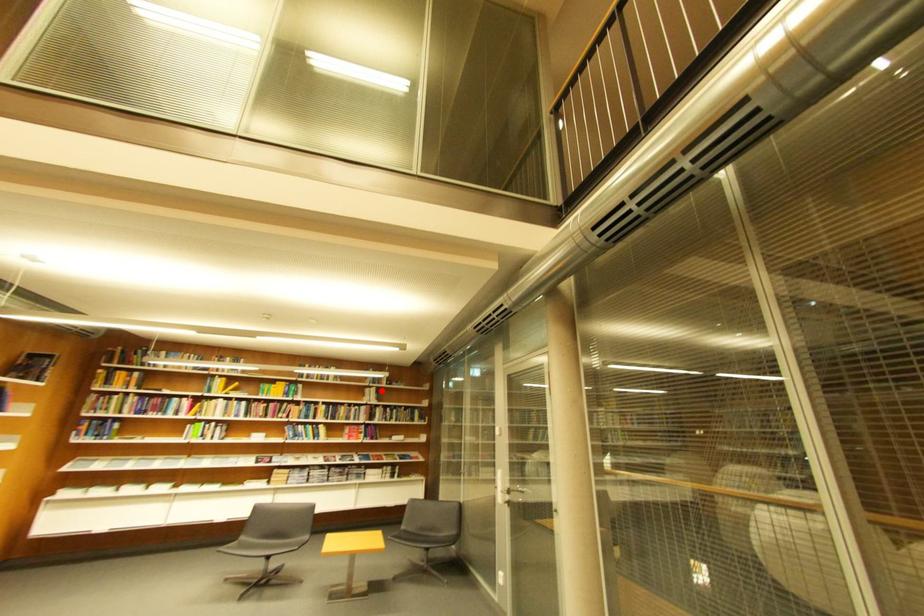
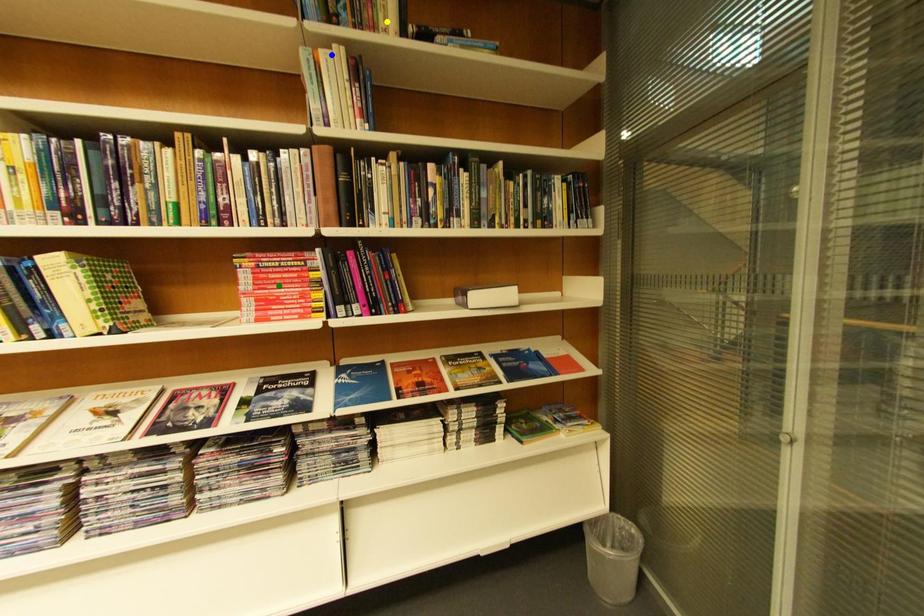
Question: I am providing you with two images of the same scene from different viewpoints. A red point is marked on the first image. You are given multiple points on the second image. Can you choose the point in image 2 that corresponds to the point in image 1?

Choices:
 (A) blue point
 (B) yellow point
 (C) green point

Answer: (A)